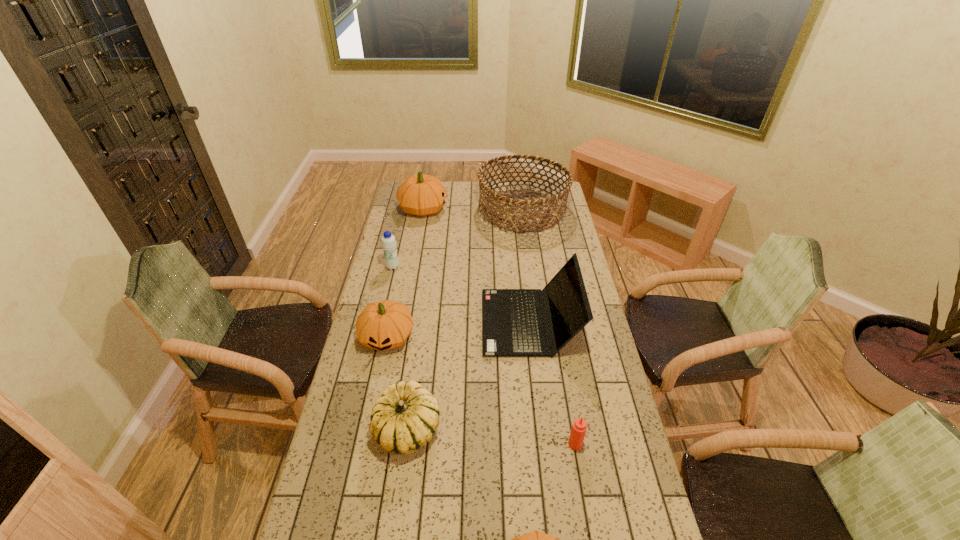
The width and height of the screenshot is (960, 540). I want to click on free spot that satisfies the following two spatial constraints: 1. on the side of the tallest gourd with the carved face; 2. on the left side of the second nearest gourd, so click(x=384, y=429).

At what (x,y) coordinates should I click in order to perform the action: click on vacant space that satisfies the following two spatial constraints: 1. on the side of the biggest orange gourd with the carved face; 2. on the left side of the basket. Please return your answer as a coordinate pair (x, y). This screenshot has width=960, height=540. Looking at the image, I should click on (423, 211).

Find the location of a particular element. The height and width of the screenshot is (540, 960). free space in the image that satisfies the following two spatial constraints: 1. on the screen of the black laptop computer; 2. on the side of the second farthest gourd with the carved face is located at coordinates (531, 336).

Locate an element on the screen. The width and height of the screenshot is (960, 540). free space in the image that satisfies the following two spatial constraints: 1. on the back side of the basket; 2. on the right side of the sixth nearest object is located at coordinates (406, 211).